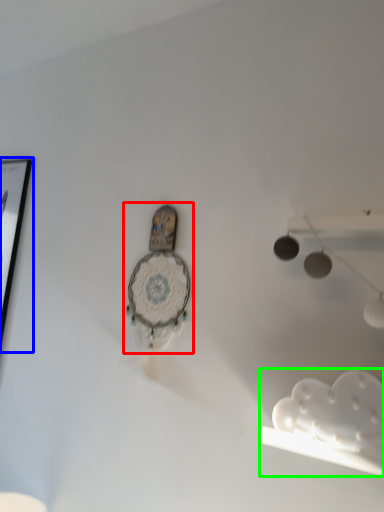
Question: Considering the real-world distances, which object is closest to clock (highlighted by a red box)? picture frame (highlighted by a blue box) or lamp (highlighted by a green box).

Choices:
 (A) picture frame
 (B) lamp

Answer: (B)